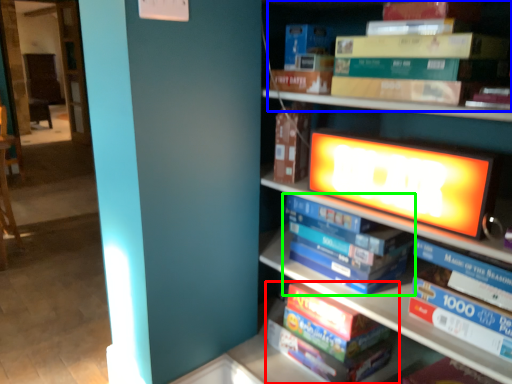
Question: Which object is the closest to the book (highlighted by a red box)? Choose among these: book (highlighted by a blue box) or book (highlighted by a green box).

Choices:
 (A) book
 (B) book

Answer: (B)